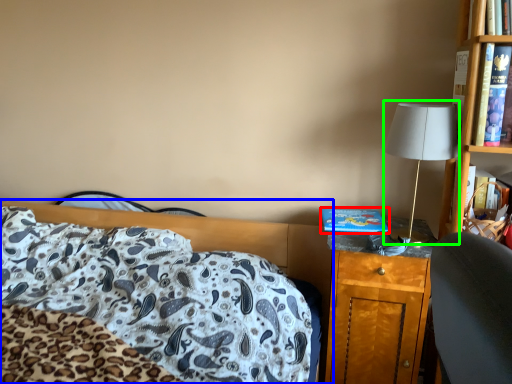
Question: Considering the real-world distances, which object is farthest from hardback book (highlighted by a red box)? bed (highlighted by a blue box) or table lamp (highlighted by a green box)?

Choices:
 (A) bed
 (B) table lamp

Answer: (A)